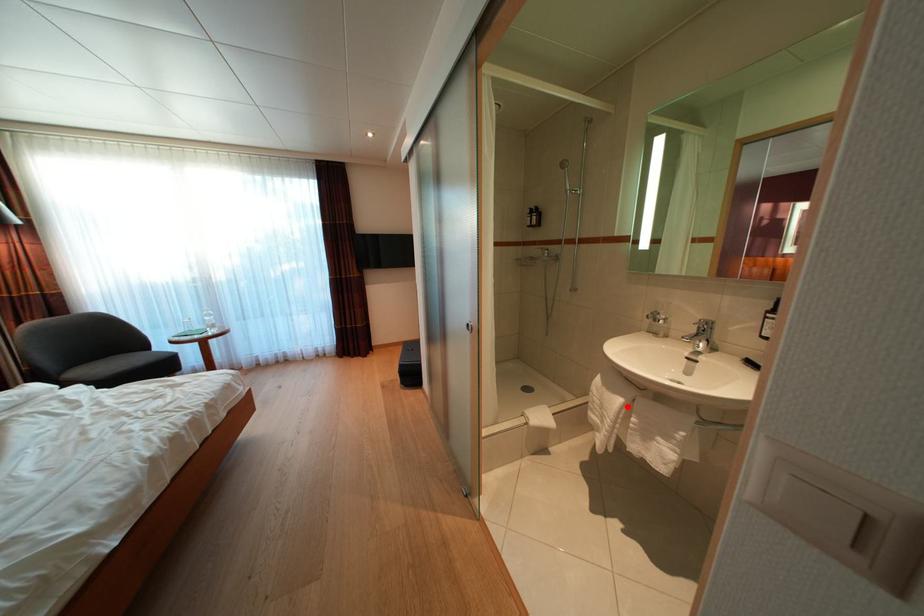
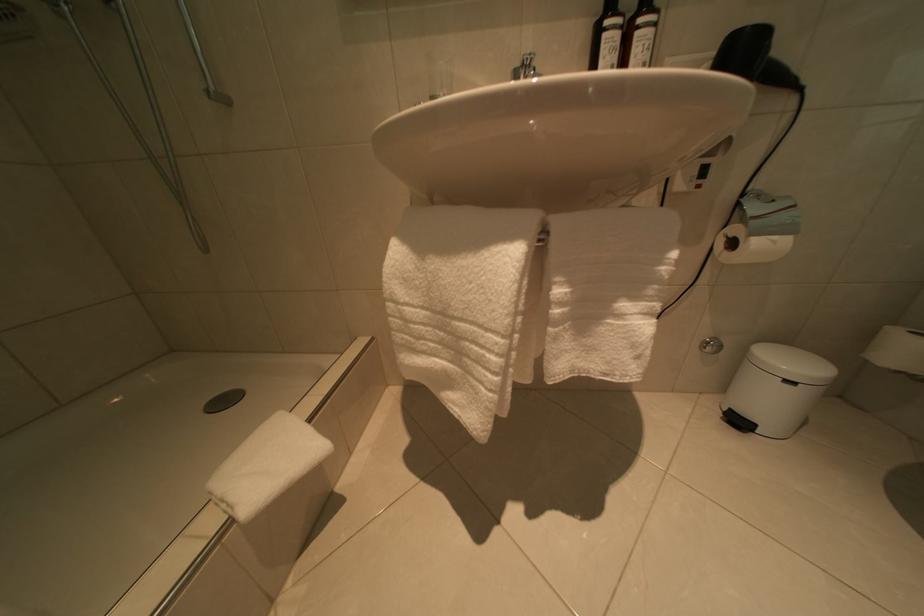
Locate, in the second image, the point that corresponds to the highlighted location in the first image.

(517, 262)